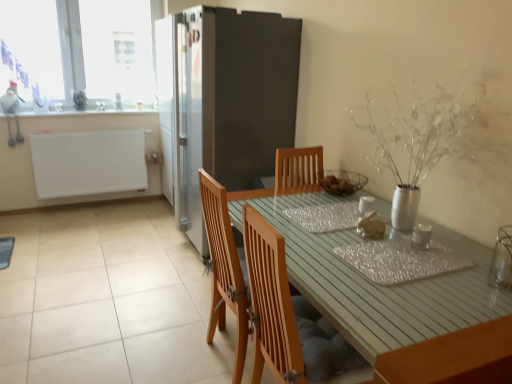
At what (x,y) coordinates should I click in order to perform the action: click on free spot above shiny metallic placemat at center (from a real-world perspective). Please return your answer as a coordinate pair (x, y). This screenshot has width=512, height=384. Looking at the image, I should click on (407, 254).